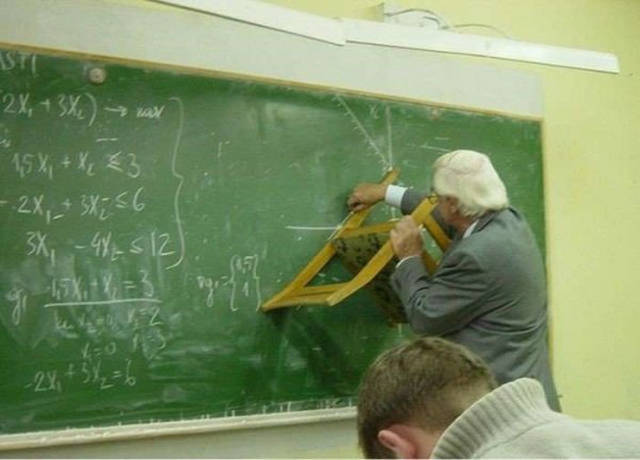
You are a GUI agent. You are given a task and a screenshot of the screen. Output one action in this format:
    pyautogui.click(x=<x>, y=<y>)
    Task: Click on the wall
    
    Given the screenshot: What is the action you would take?
    pyautogui.click(x=628, y=262)